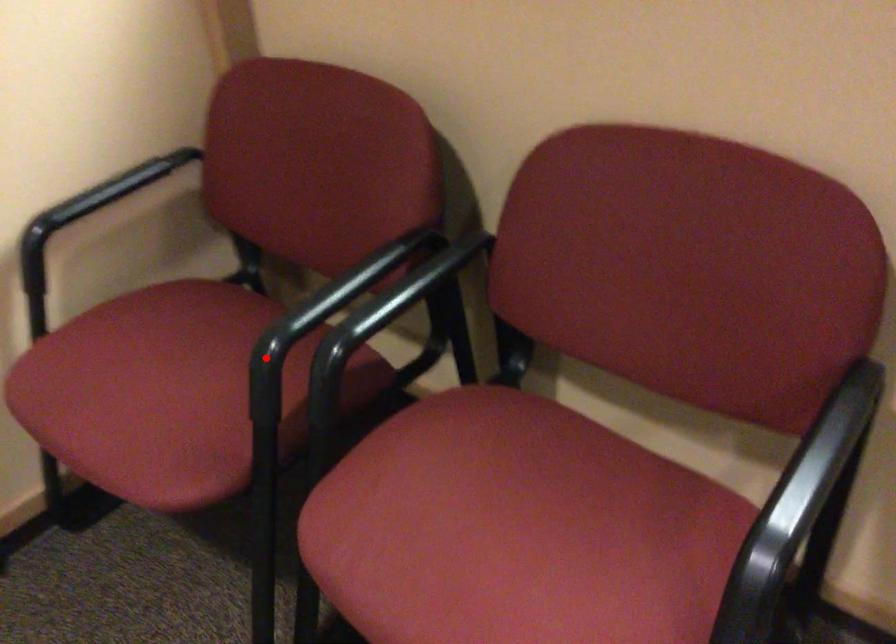
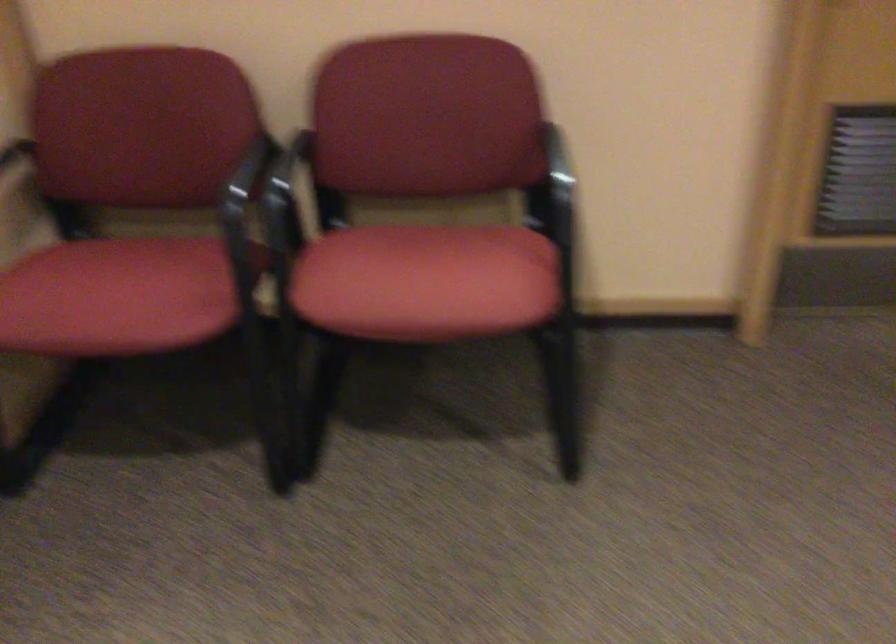
In the second image, find the point that corresponds to the highlighted location in the first image.

(244, 212)